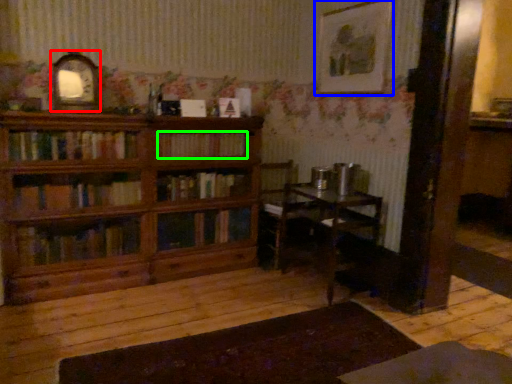
Question: Considering the real-world distances, which object is farthest from picture frame (highlighted by a red box)? picture frame (highlighted by a blue box) or book (highlighted by a green box)?

Choices:
 (A) picture frame
 (B) book

Answer: (A)